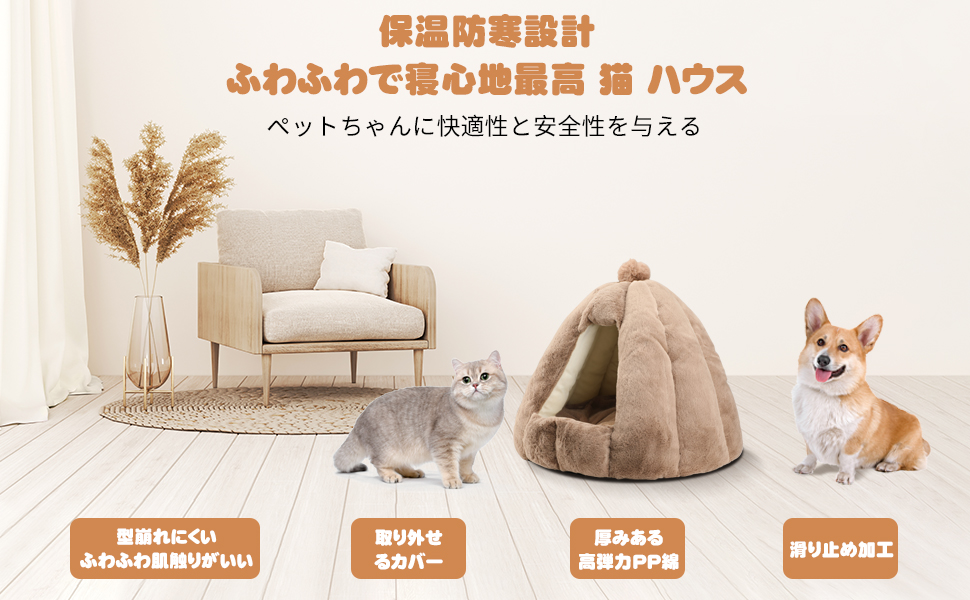
Where is `wall`? wall is located at coordinates (516, 208).